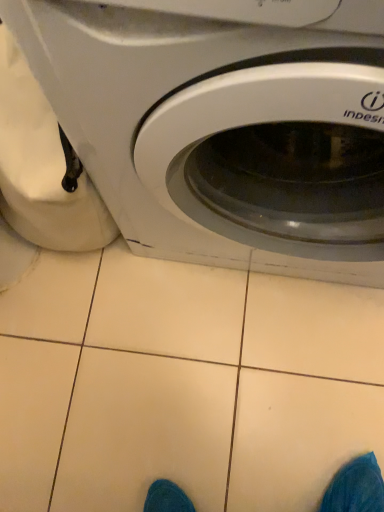
I want to click on white glossy washing machine at upper center, so click(x=221, y=133).

This screenshot has width=384, height=512. Describe the element at coordinates (221, 133) in the screenshot. I see `white glossy washing machine at upper center` at that location.

The image size is (384, 512). In order to click on white glossy washing machine at upper center in this screenshot , I will do `click(221, 133)`.